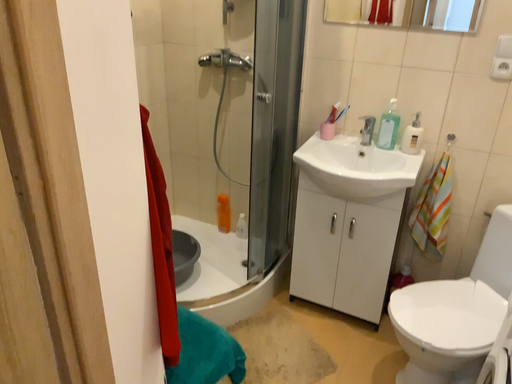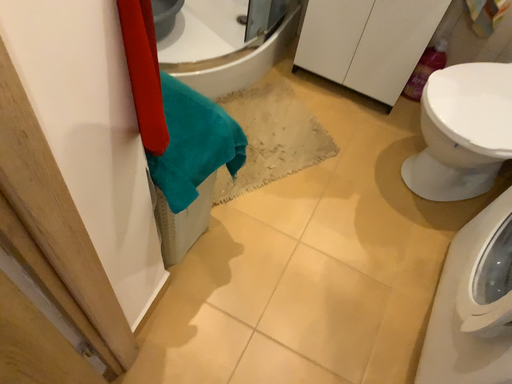
Question: How did the camera likely rotate when shooting the video?

Choices:
 (A) rotated upward
 (B) rotated downward

Answer: (B)